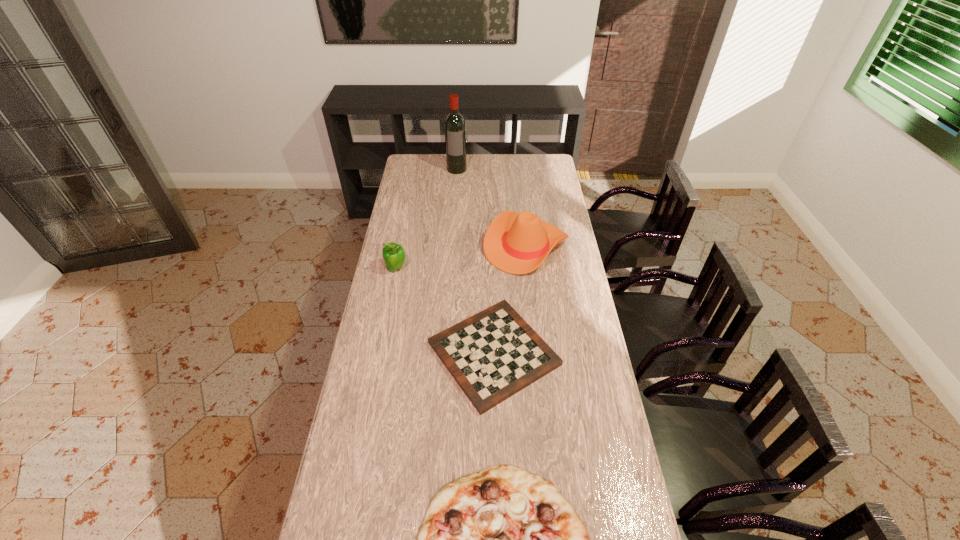
Find the location of `object positioned at the far edge`. object positioned at the far edge is located at coordinates (455, 130).

Where is `object that is at the left edge`? object that is at the left edge is located at coordinates (393, 254).

You are a GUI agent. You are given a task and a screenshot of the screen. Output one action in this format:
    pyautogui.click(x=<x>, y=<y>)
    Task: Click on the cowboy hat that is at the right edge
    
    Given the screenshot: What is the action you would take?
    pyautogui.click(x=517, y=243)

The width and height of the screenshot is (960, 540). I want to click on chessboard at the right edge, so click(x=492, y=355).

In the image, there is a desktop. Identify the location of blank space at the far edge. (494, 158).

In the image, there is a desktop. What are the coordinates of `blank space at the left edge` in the screenshot? It's located at (405, 288).

At what (x,y) coordinates should I click in order to perform the action: click on free spot at the right edge of the desktop. Please return your answer as a coordinate pair (x, y). This screenshot has width=960, height=540. Looking at the image, I should click on (580, 422).

The height and width of the screenshot is (540, 960). I want to click on vacant space at the far left corner, so coord(426,158).

Locate an element on the screen. Image resolution: width=960 pixels, height=540 pixels. unoccupied position between the bell pepper and the cowboy hat is located at coordinates point(461,257).

Locate an element on the screen. The image size is (960, 540). free space between the cowboy hat and the wine bottle is located at coordinates (492, 207).